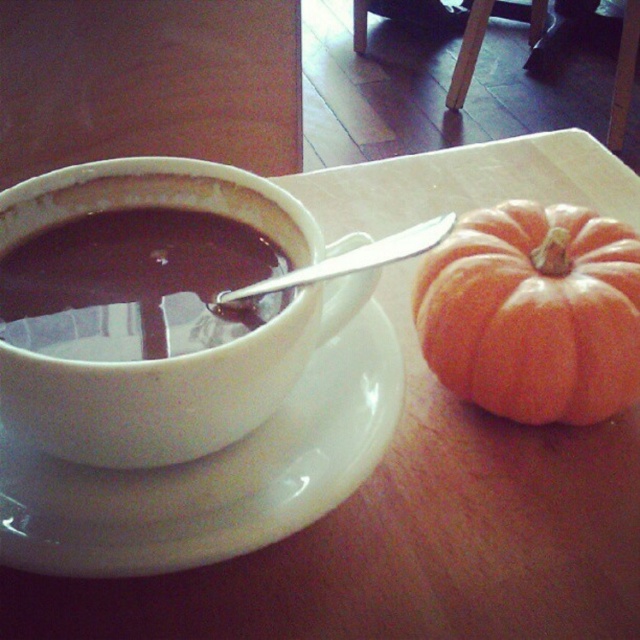
Question: Does orange matte pumpkin at right have a smaller size compared to satin silver spoon at upper center?

Choices:
 (A) yes
 (B) no

Answer: (B)

Question: Which is nearer to the matte ceramic cup at left?

Choices:
 (A) white glossy saucer at center
 (B) satin silver spoon at upper center

Answer: (B)

Question: Considering the relative positions of orange matte pumpkin at right and matte ceramic cup at left in the image provided, where is orange matte pumpkin at right located with respect to matte ceramic cup at left?

Choices:
 (A) left
 (B) right

Answer: (B)

Question: Which of the following is the closest to the observer?

Choices:
 (A) matte ceramic cup at left
 (B) orange matte pumpkin at right
 (C) white glossy saucer at center

Answer: (C)

Question: Which of these objects is positioned closest to the matte ceramic cup at left?

Choices:
 (A) satin silver spoon at upper center
 (B) white glossy saucer at center
 (C) orange matte pumpkin at right

Answer: (A)

Question: Does white glossy saucer at center have a greater width compared to satin silver spoon at upper center?

Choices:
 (A) yes
 (B) no

Answer: (A)